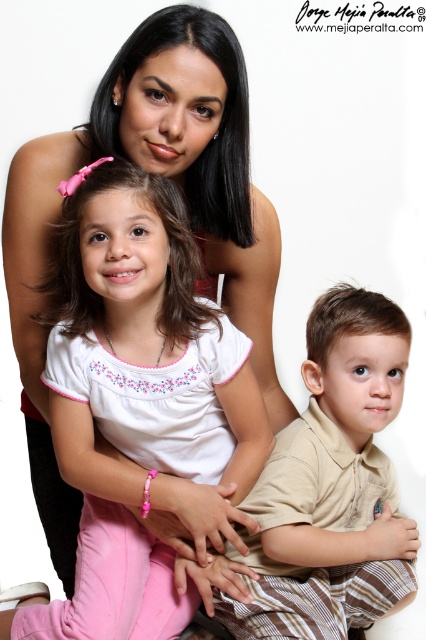
Question: Can you confirm if white cotton shirt at center is smaller than brown plaid pants at lower right?

Choices:
 (A) yes
 (B) no

Answer: (B)

Question: Is white cotton shirt at center below brown plaid pants at lower right?

Choices:
 (A) yes
 (B) no

Answer: (B)

Question: Which point appears farthest from the camera in this image?

Choices:
 (A) (184, 577)
 (B) (204, 516)

Answer: (A)

Question: Does white cotton shirt at center appear under brown plaid pants at lower right?

Choices:
 (A) yes
 (B) no

Answer: (B)

Question: Which point is farther to the camera?

Choices:
 (A) brown plaid pants at lower right
 (B) white cotton shirt at center

Answer: (A)